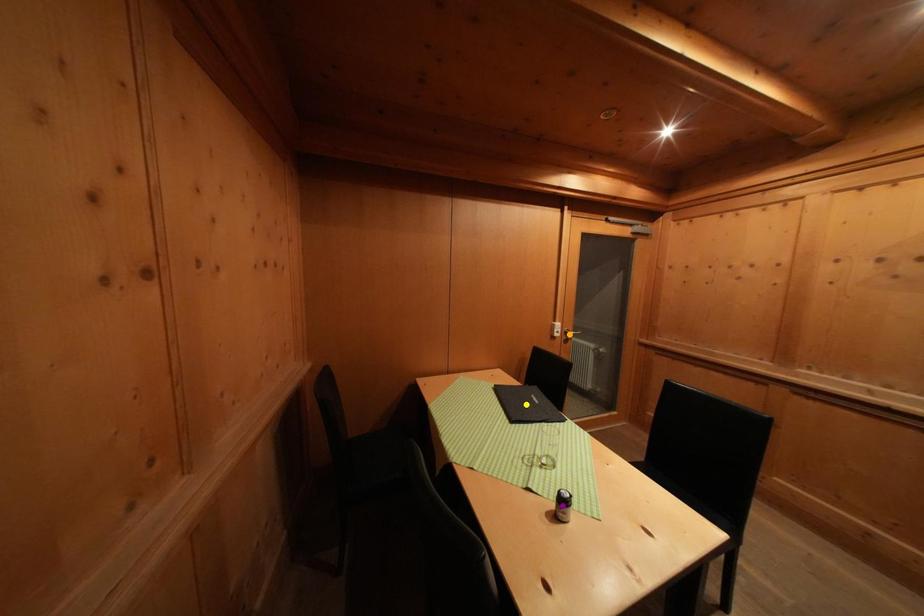
Looking at this image, order these from nearest to farthest:
purple point | yellow point | orange point

purple point, yellow point, orange point